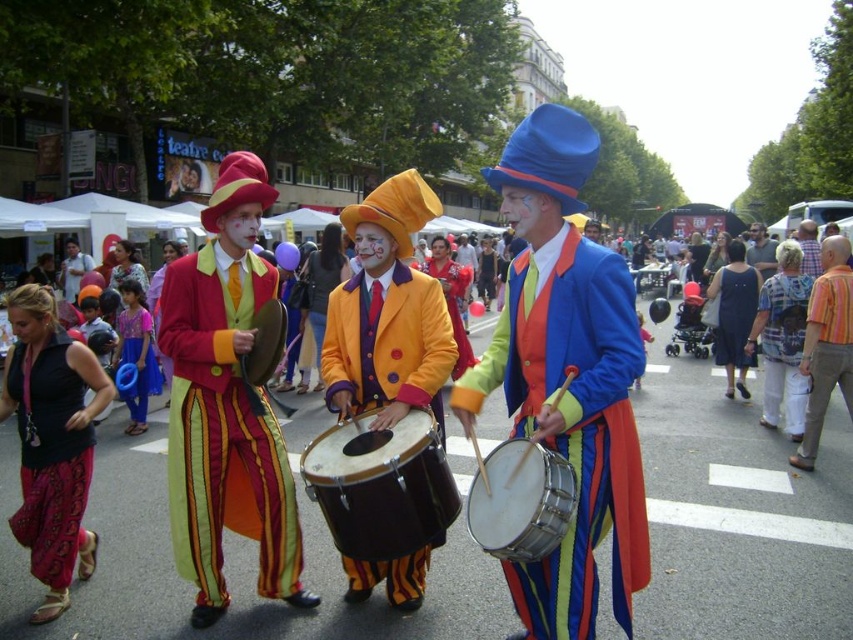
Which of these two, striped cotton shirt at center or matte black dress at center, stands shorter?

With less height is matte black dress at center.

Between point (805, 369) and point (741, 342), which one is positioned in front?

Point (805, 369)

Who is more forward, (831, 241) or (758, 289)?

Point (831, 241)

The width and height of the screenshot is (853, 640). What are the coordinates of `striped cotton shirt at center` in the screenshot? It's located at (827, 344).

In the scene shown: Between patterned fabric pants at lower left and matte black dress at center, which one has less height?

With less height is matte black dress at center.

Is the position of patterned fabric pants at lower left less distant than that of matte black dress at center?

Yes, it is in front of matte black dress at center.

Where is `patterned fabric pants at lower left`? The image size is (853, 640). patterned fabric pants at lower left is located at coordinates (50, 460).

How far apart are patterned fabric pants at lower left and patterned fabric shirt at center?

The distance of patterned fabric pants at lower left from patterned fabric shirt at center is 6.60 meters.

Does patterned fabric pants at lower left have a lesser width compared to patterned fabric shirt at center?

Indeed, patterned fabric pants at lower left has a lesser width compared to patterned fabric shirt at center.

Does point (19, 349) lie behind point (790, 348)?

No, it is in front of (790, 348).

Where is `patterned fabric pants at lower left`? The image size is (853, 640). patterned fabric pants at lower left is located at coordinates (50, 460).